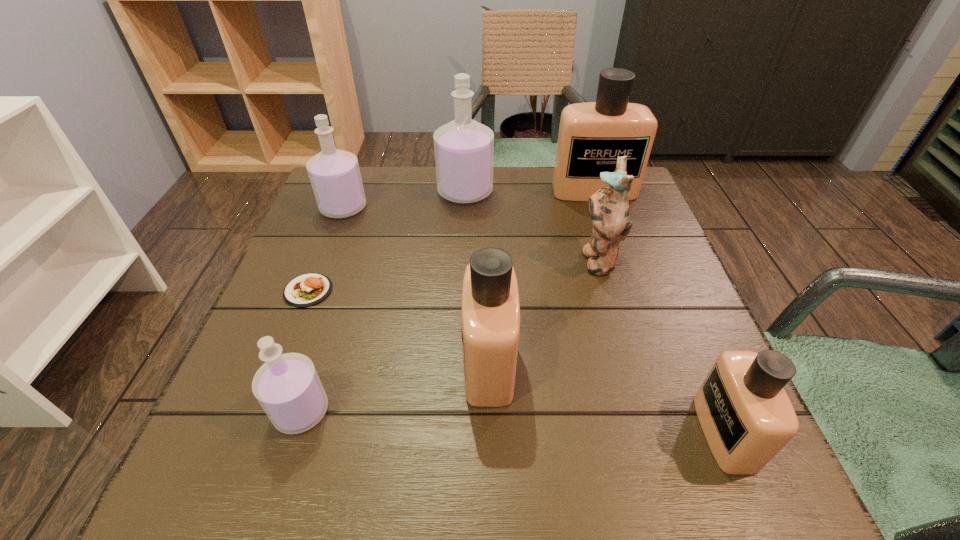
Image resolution: width=960 pixels, height=540 pixels. I want to click on free space located 0.250m on the front-facing side of the figurine, so click(467, 259).

This screenshot has height=540, width=960. Find the location of `blank space located 0.390m on the front-facing side of the figurine`. blank space located 0.390m on the front-facing side of the figurine is located at coordinates (403, 259).

The image size is (960, 540). Identify the location of vacant region located on the front-facing side of the figurine. (420, 259).

Find the location of a particular element. vacant space located 0.320m on the right of the second smallest purple perfume is located at coordinates (493, 208).

In order to click on free space located 0.080m on the front label of the leftmost beige perfume in this screenshot , I will do `click(419, 363)`.

You are a GUI agent. You are given a task and a screenshot of the screen. Output one action in this format:
    pyautogui.click(x=<x>, y=<y>)
    Task: Click on the vacant space located on the front label of the leftmost beige perfume
    
    Given the screenshot: What is the action you would take?
    pyautogui.click(x=350, y=363)

Image resolution: width=960 pixels, height=540 pixels. Identify the location of vacant space located on the front label of the leftmost beige perfume. (310, 363).

Locate an element on the screen. The width and height of the screenshot is (960, 540). vacant space located on the back of the smallest purple perfume is located at coordinates (319, 357).

The width and height of the screenshot is (960, 540). What are the coordinates of `vacant space located on the front label of the smallest beige perfume` in the screenshot? It's located at (651, 433).

Where is `free space located on the front label of the smallest beige perfume`? The height and width of the screenshot is (540, 960). free space located on the front label of the smallest beige perfume is located at coordinates (540, 433).